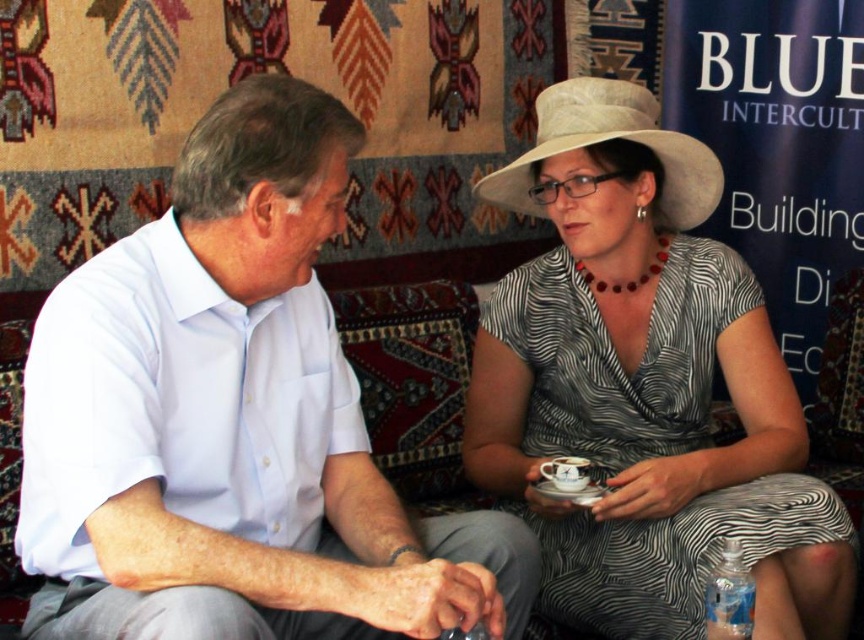
Can you confirm if beige straw hat at upper right is shorter than clear plastic bottle at lower right?

Incorrect, beige straw hat at upper right's height does not fall short of clear plastic bottle at lower right's.

In the scene shown: Is beige straw hat at upper right below clear plastic bottle at lower right?

No.

This screenshot has width=864, height=640. In order to click on beige straw hat at upper right in this screenshot , I will do `click(611, 140)`.

Does white cotton shirt at center appear on the right side of white textured hat at upper right?

No, white cotton shirt at center is not to the right of white textured hat at upper right.

Who is more forward, (194,554) or (659,324)?

Point (194,554)

Where is `white cotton shirt at center`? This screenshot has height=640, width=864. white cotton shirt at center is located at coordinates (233, 420).

Does white textured hat at upper right appear on the right side of clear plastic bottle at lower right?

Incorrect, white textured hat at upper right is not on the right side of clear plastic bottle at lower right.

Measure the distance between point [544,177] and camera.

They are 5.41 feet apart.

Find the location of `white textured hat at upper right`. white textured hat at upper right is located at coordinates (645, 387).